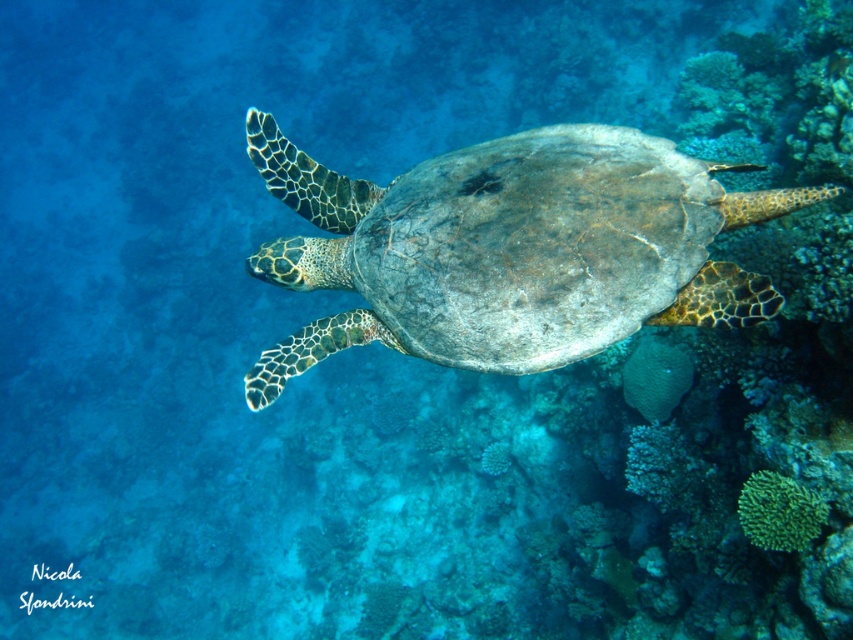
Is the position of leathery greenish-brown turtle at center more distant than that of green matte coral at lower right?

No, it is not.

Is point (654, 234) closer to viewer compared to point (755, 483)?

Yes, point (654, 234) is closer to viewer.

Locate an element on the screen. The width and height of the screenshot is (853, 640). leathery greenish-brown turtle at center is located at coordinates (509, 250).